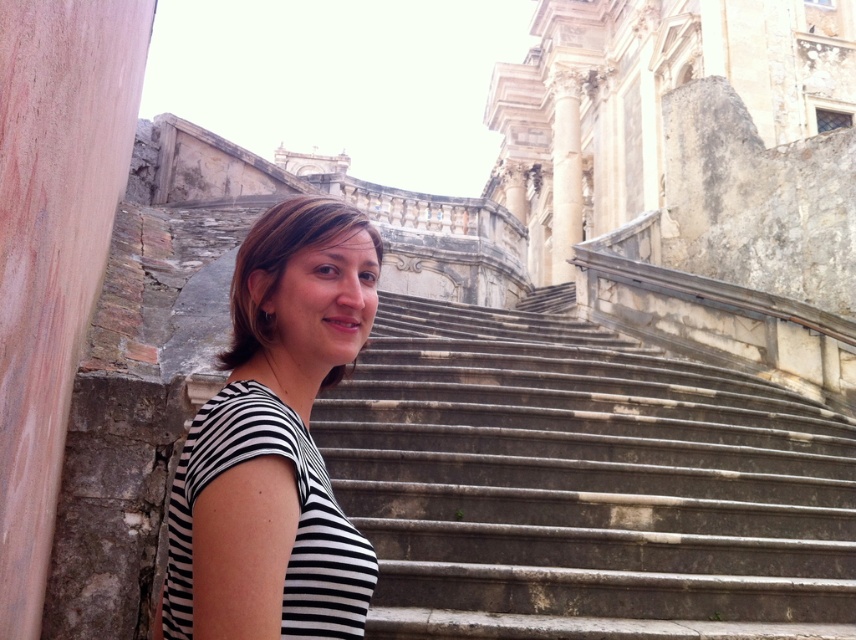
Does black striped shirt at center have a lesser height compared to white marble column at upper center?

Correct, black striped shirt at center is not as tall as white marble column at upper center.

Is black striped shirt at center above white marble column at upper center?

Incorrect, black striped shirt at center is not positioned above white marble column at upper center.

Locate an element on the screen. The width and height of the screenshot is (856, 640). black striped shirt at center is located at coordinates (275, 442).

Between stone stairs at center and white marble column at upper center, which one appears on the right side from the viewer's perspective?

Positioned to the right is white marble column at upper center.

This screenshot has height=640, width=856. Identify the location of stone stairs at center. (584, 483).

How far apart are stone stairs at center and black striped shirt at center?

stone stairs at center is 57.57 feet from black striped shirt at center.

Who is positioned more to the left, stone stairs at center or black striped shirt at center?

From the viewer's perspective, black striped shirt at center appears more on the left side.

Is point (779, 513) behind point (224, 385)?

Yes, it is behind point (224, 385).

I want to click on stone stairs at center, so click(584, 483).